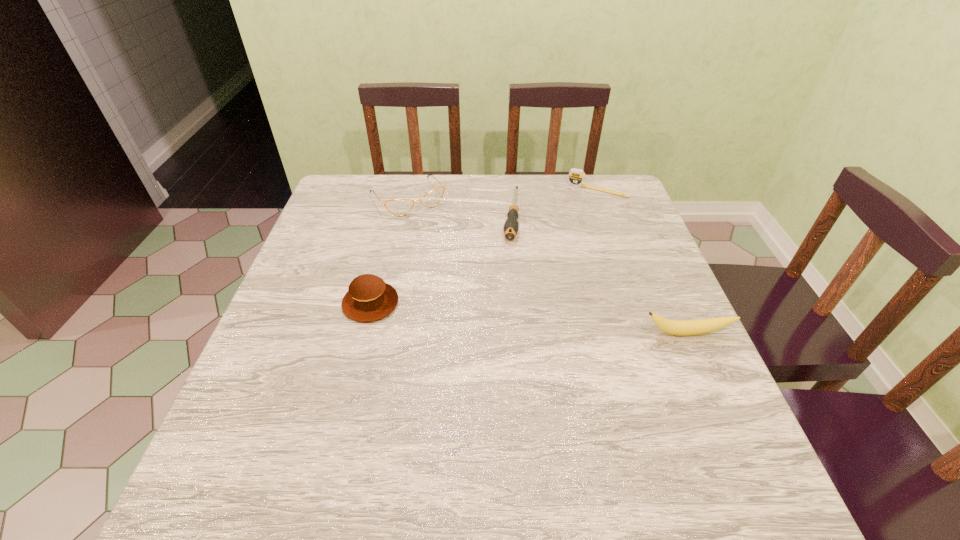
Image resolution: width=960 pixels, height=540 pixels. What are the coordinates of `vacant space at the far left corner of the desktop` in the screenshot? It's located at (364, 185).

At what (x,y) coordinates should I click in order to perform the action: click on free space between the second nearest object and the shortest object. Please return your answer as a coordinate pair (x, y). Looking at the image, I should click on (441, 259).

Locate an element on the screen. The height and width of the screenshot is (540, 960). empty location between the muffin and the nearest object is located at coordinates (529, 318).

Image resolution: width=960 pixels, height=540 pixels. I want to click on free space between the third object from left to right and the spectacles, so click(460, 207).

Where is `empty location between the fourth farthest object and the second shortest object`? This screenshot has width=960, height=540. empty location between the fourth farthest object and the second shortest object is located at coordinates (484, 246).

I want to click on free space between the second shortest object and the screwdriver, so click(x=554, y=203).

Locate an element on the screen. vacant space that's between the tape measure and the spectacles is located at coordinates (503, 194).

Locate an element on the screen. This screenshot has width=960, height=540. vacant region between the banana and the tape measure is located at coordinates (642, 261).

Locate an element on the screen. free spot between the spectacles and the nearest object is located at coordinates (547, 266).

Where is `empty space between the nearest object and the spectacles`? Image resolution: width=960 pixels, height=540 pixels. empty space between the nearest object and the spectacles is located at coordinates (547, 266).